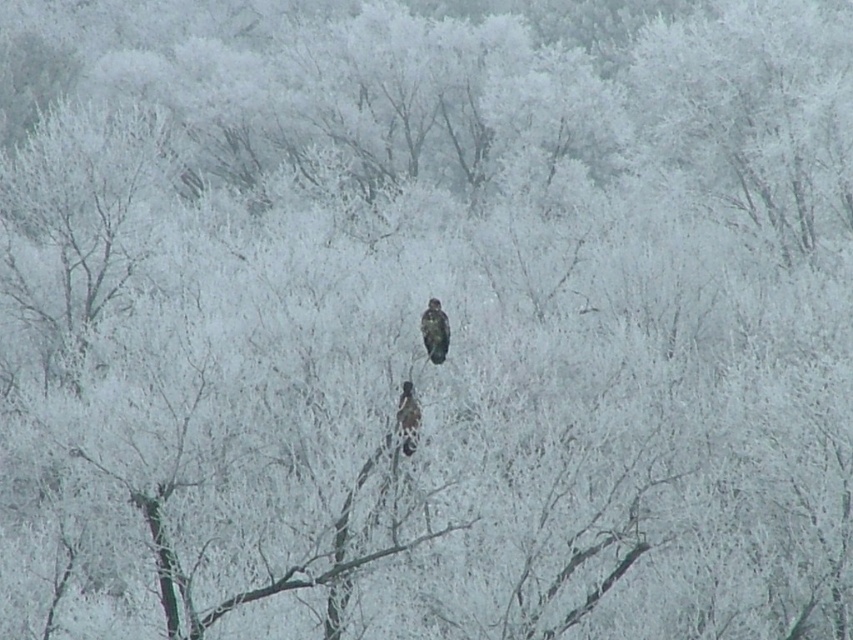
What are the coordinates of the brown feathered bird at center?

The brown feathered bird at center is located at coordinates point (434, 332).

You are standing in the winter forest and want to take a photo of both birds. The first bird is at point (433, 330) and the second bird is at point (405, 396). To ensure both are in focus, which bird should you focus on first?

You should focus on the bird at point (405, 396) first because it is closer to you than the bird at point (433, 330), which is further away. By focusing on the closer bird, you can adjust the focus to include both in the frame.

You are an ornithologist observing the winter forest scene. You notice two birds at the center. The first is a brown feathered bird at center and the second is dark brown feathers at center. Which bird would cast a larger shadow on the frosty branches below?

The brown feathered bird at center is larger in size than dark brown feathers at center, so it would cast a larger shadow on the frosty branches below.